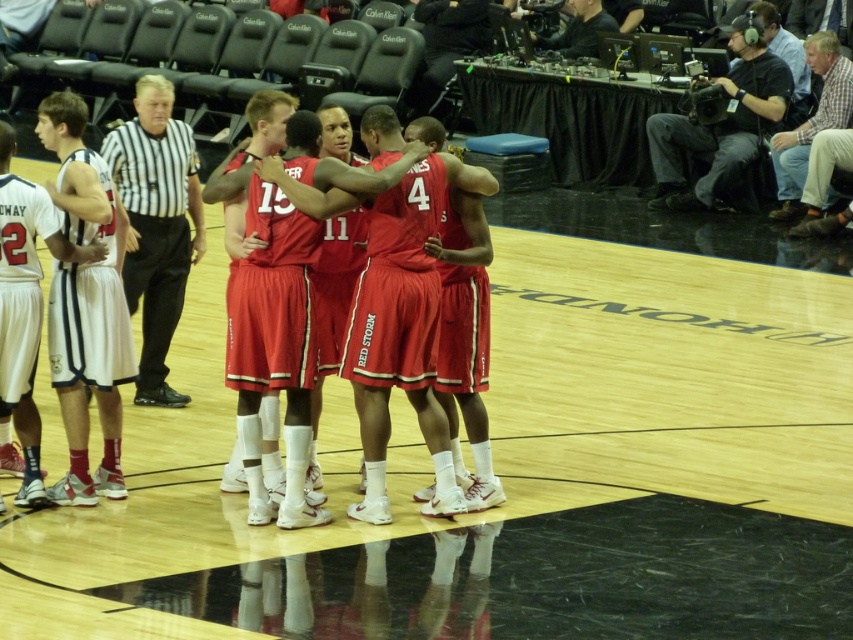
In the scene shown: You are a photographer standing at the back of the court. You want to take a photo of the shiny red jersey at center and the black striped shirt at left. Which one will appear larger in the photo?

The shiny red jersey at center will appear larger in the photo because it is closer to the viewer than the black striped shirt at left.

You are a photographer positioned at the center of the court. You want to take a photo of the white matte basketball guard at left and the plaid shirt at upper right. Which object should you focus on first to ensure both are in sharp focus?

The white matte basketball guard at left is closer to the viewer than the plaid shirt at upper right. To ensure both are in sharp focus, you should focus on the white matte basketball guard at left first, as it is closer, and the depth of field will extend to the plaid shirt at upper right.